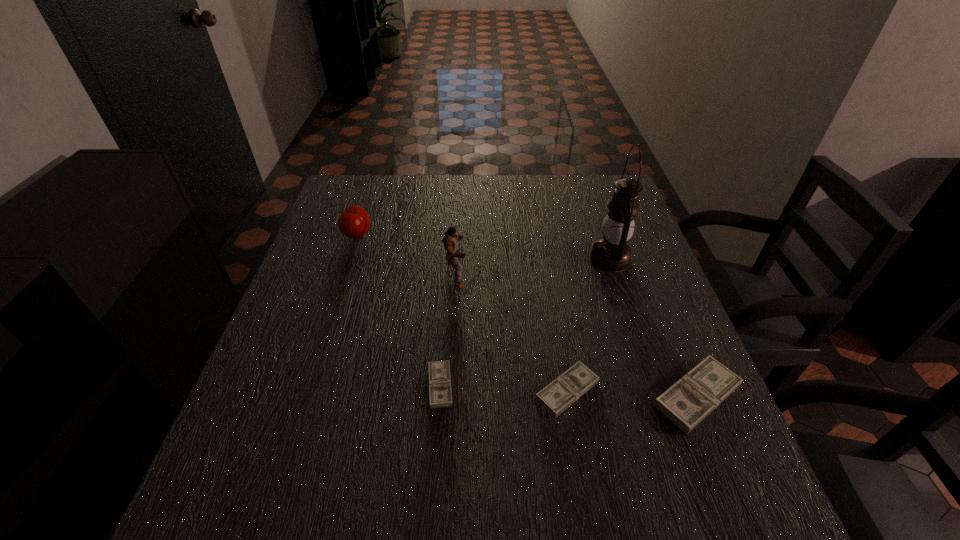
Identify the location of the shortest object. point(440,394).

The image size is (960, 540). What are the coordinates of `the leftmost money` in the screenshot? It's located at (440, 394).

This screenshot has width=960, height=540. In order to click on the fifth tallest object in this screenshot , I will do `click(557, 396)`.

What are the coordinates of `the second tallest money` in the screenshot? It's located at (557, 396).

Image resolution: width=960 pixels, height=540 pixels. What are the coordinates of `the rightmost money` in the screenshot? It's located at (692, 398).

Find the location of `the tallest money`. the tallest money is located at coordinates (692, 398).

Find the location of a particular element. This screenshot has width=960, height=540. the leftmost object is located at coordinates (354, 222).

Where is `apple`? The width and height of the screenshot is (960, 540). apple is located at coordinates tap(354, 222).

Identify the location of the fifth shortest object. This screenshot has height=540, width=960. (450, 239).

At what (x,y) coordinates should I click in order to perform the action: click on the tallest object. Please return your answer as a coordinate pair (x, y). The width and height of the screenshot is (960, 540). Looking at the image, I should click on (612, 254).